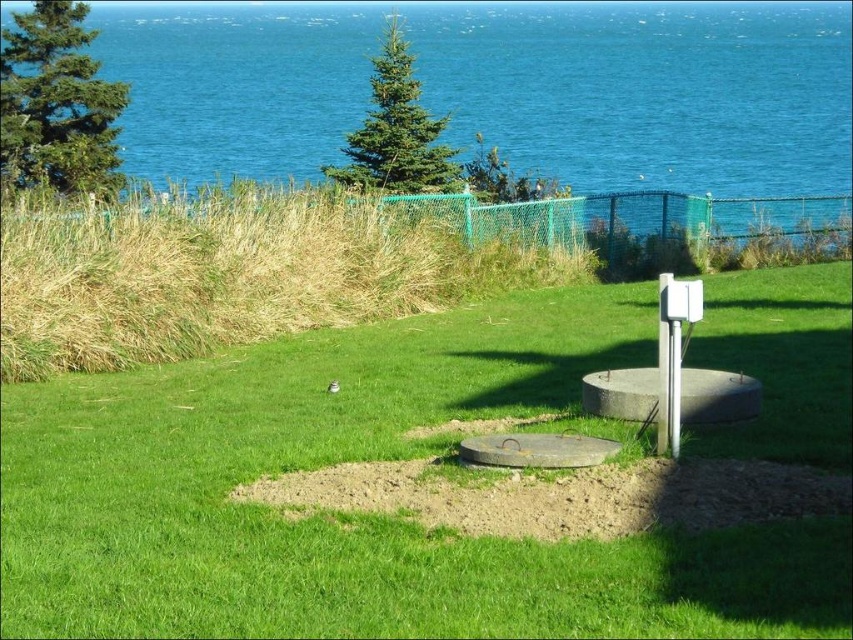
Is green grassy at center further to camera compared to blue water at upper center?

That is False.

Does green grassy at center have a greater width compared to blue water at upper center?

In fact, green grassy at center might be narrower than blue water at upper center.

Is point (392, 452) in front of point (589, 67)?

Yes, it is.

Where is `green grassy at center`? green grassy at center is located at coordinates (361, 516).